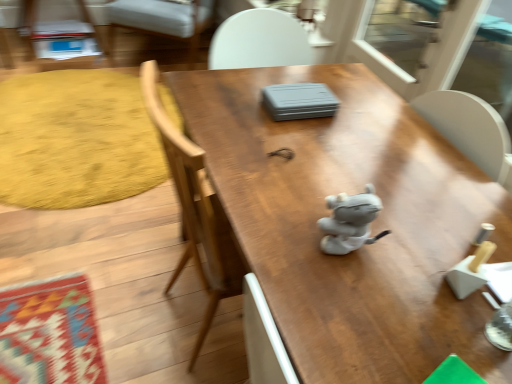
Find the location of a particular element. free space to the back side of gray fabric toy at center is located at coordinates (340, 180).